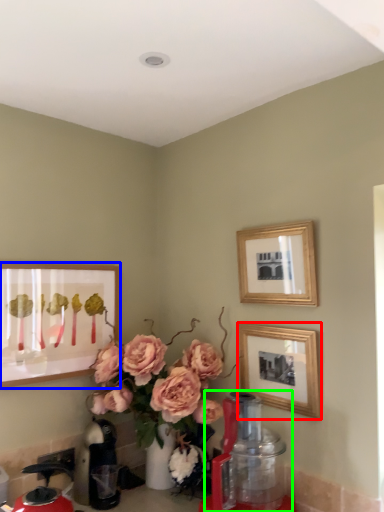
Question: Which object is the farthest from picture frame (highlighted by a red box)? Choose among these: picture frame (highlighted by a blue box) or blender (highlighted by a green box).

Choices:
 (A) picture frame
 (B) blender

Answer: (A)